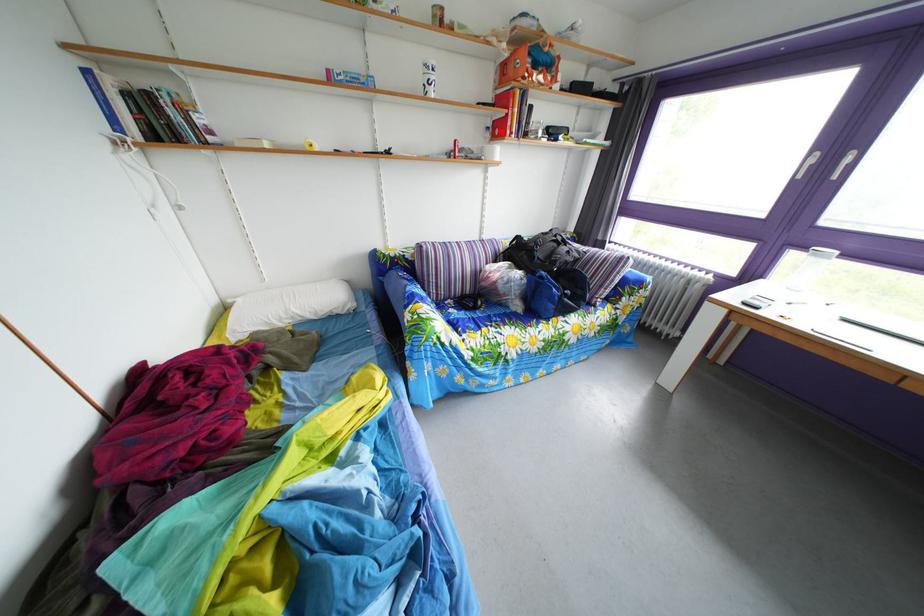
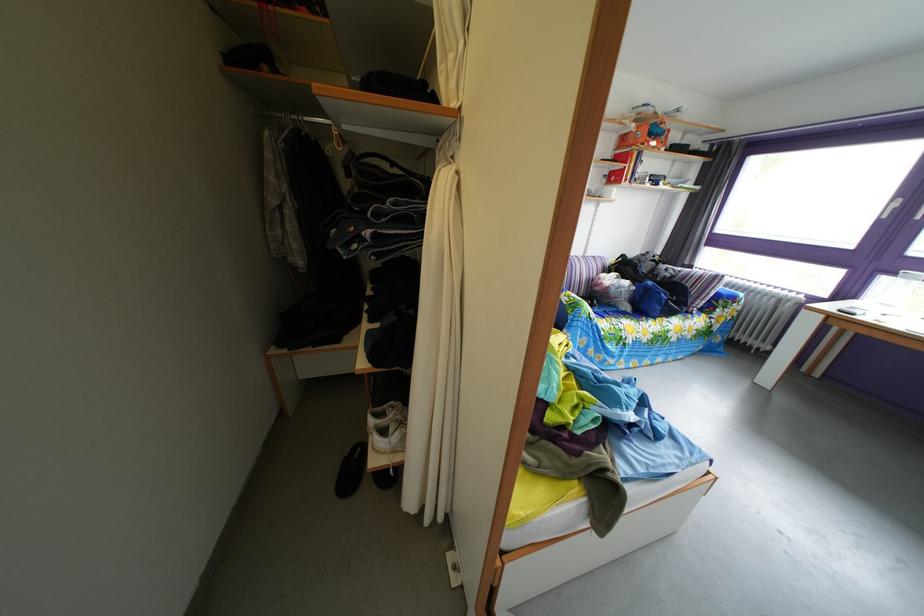
In the second image, find the point that corresponds to the highlighted location in the first image.

(618, 180)